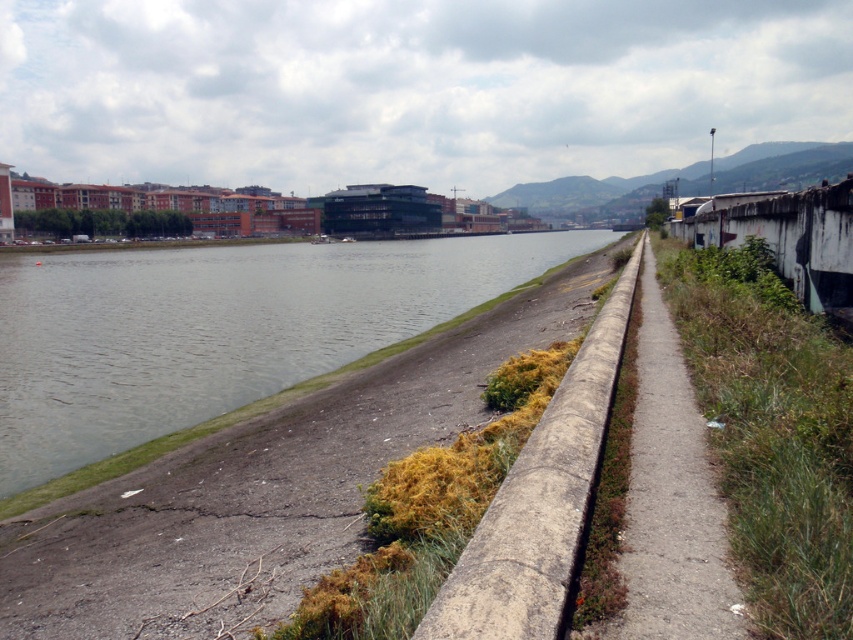
You are a city planner assessing the riverside area. You need to determine which of the two features, the green concrete river at center or the concrete at center, is wider to allocate space for a new pedestrian walkway. Which one is wider?

The green concrete river at center is wider than the concrete at center, so the pedestrian walkway should be allocated on the side of the green concrete river at center.